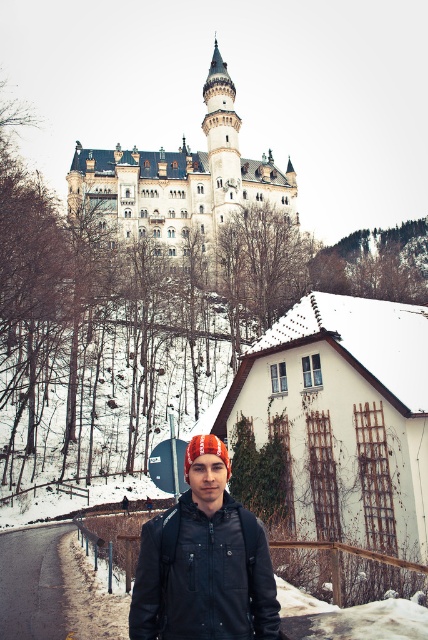
You are standing at the point marked by the coordinates point (199, 195) in the winter scene. Which object are you on?

The point (199, 195) is located on the white stone castle at upper center.

You are a tourist holding a camera and want to take a photo of the white stone castle at upper center without the black leather jacket at center blocking the view. Is the jacket currently blocking the view of the castle?

The white stone castle at upper center is above the black leather jacket at center, so the jacket is not blocking the view of the castle.

You are a photographer trying to capture the white stone castle at upper center and the black leather jacket at center in a single frame. Based on the scene, which object will appear larger in the photo?

The white stone castle at upper center will appear larger in the photo because it is taller than the black leather jacket at center.